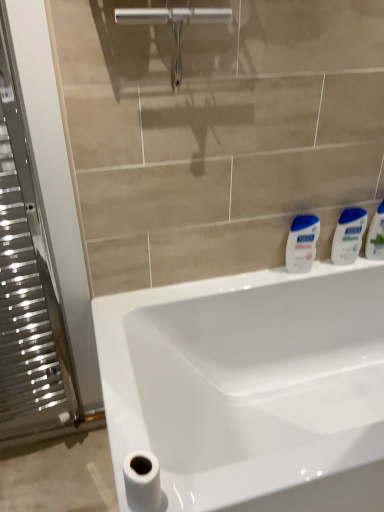
The height and width of the screenshot is (512, 384). What are the coordinates of `vacant space situated on the left part of white glossy lotion at right` in the screenshot? It's located at (258, 280).